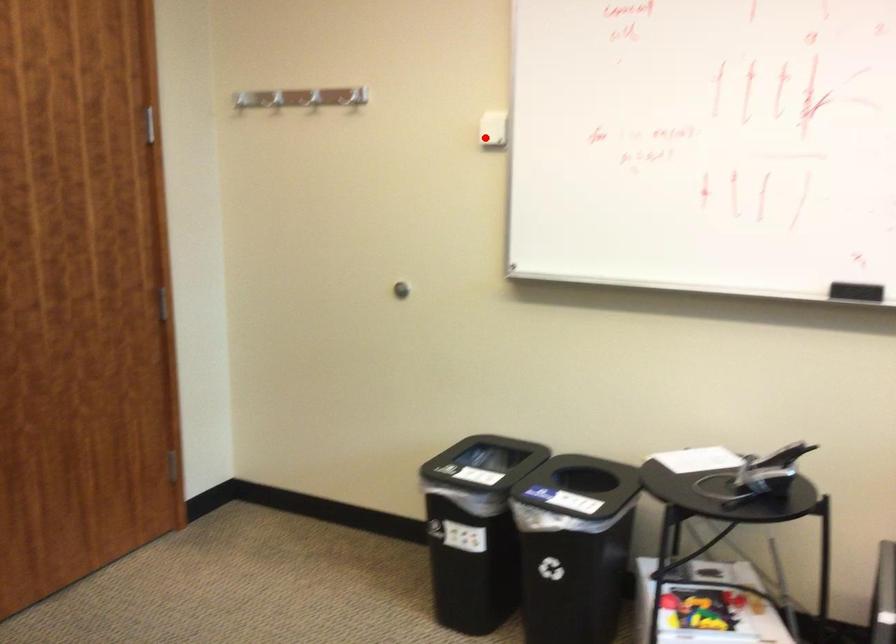
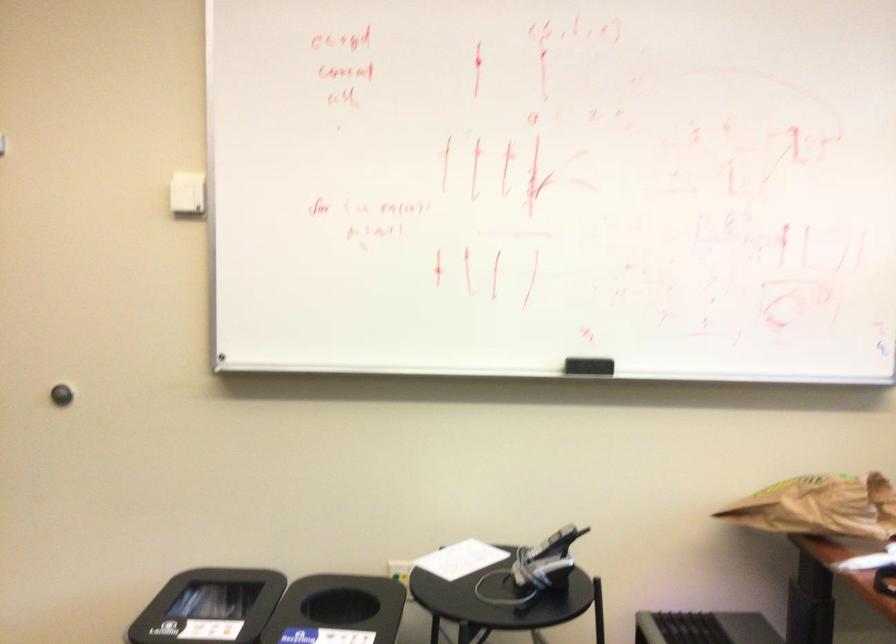
Question: I am providing you with two images of the same scene from different viewpoints. Given a red point in image1, look at the same physical point in image2. Is it:

Choices:
 (A) Closer to the viewpoint
 (B) Farther from the viewpoint

Answer: (A)